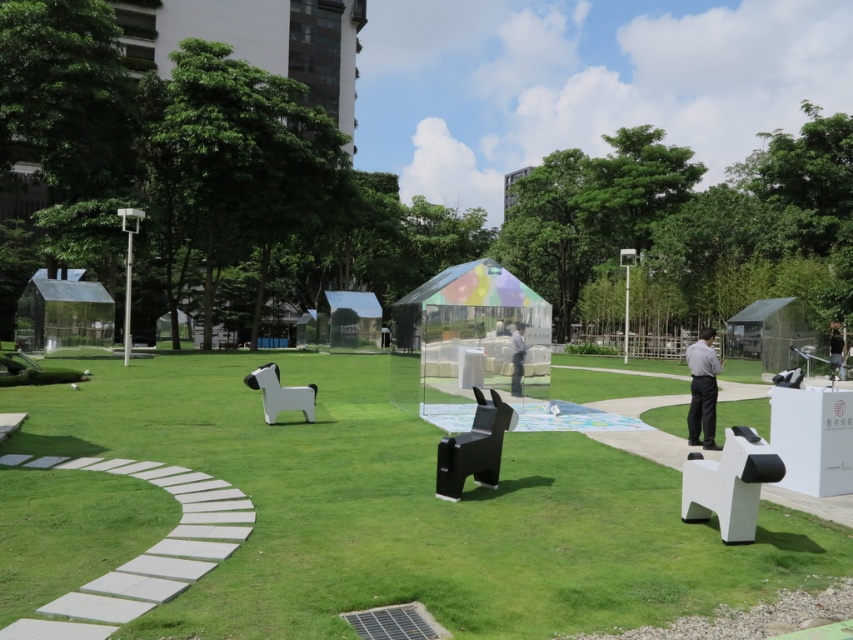
Which is below, white matte dog at center or gray fabric person at center?

Positioned lower is white matte dog at center.

Is white matte dog at center to the left of gray fabric person at center from the viewer's perspective?

Yes, white matte dog at center is to the left of gray fabric person at center.

Between point (549, 493) and point (520, 337), which one is positioned in front?

Positioned in front is point (549, 493).

Find the location of `white matte dog at center`. white matte dog at center is located at coordinates (410, 509).

Can you confirm if white matte dog at center is positioned above smooth gray shirt at right?

Actually, white matte dog at center is below smooth gray shirt at right.

Is white matte dog at center in front of smooth gray shirt at right?

Yes, it is in front of smooth gray shirt at right.

Is point (496, 573) positioned in front of point (834, 337)?

That is True.

Locate an element on the screen. white matte dog at center is located at coordinates (410, 509).

Which is more to the left, black plastic dog at center or gray fabric person at center?

Positioned to the left is black plastic dog at center.

Which is above, black plastic dog at center or gray fabric person at center?

gray fabric person at center is higher up.

Between point (451, 477) and point (517, 324), which one is positioned in front?

Point (451, 477)

Where is `black plastic dog at center`? Image resolution: width=853 pixels, height=640 pixels. black plastic dog at center is located at coordinates (473, 449).